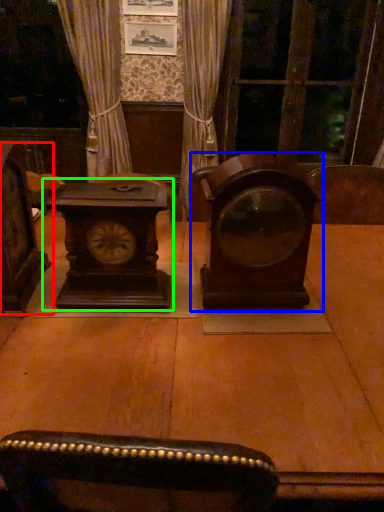
Question: Estimate the real-world distances between objects in this image. Which object is farther from furniture (highlighted by a red box), alarm clock (highlighted by a blue box) or alarm clock (highlighted by a green box)?

Choices:
 (A) alarm clock
 (B) alarm clock

Answer: (A)